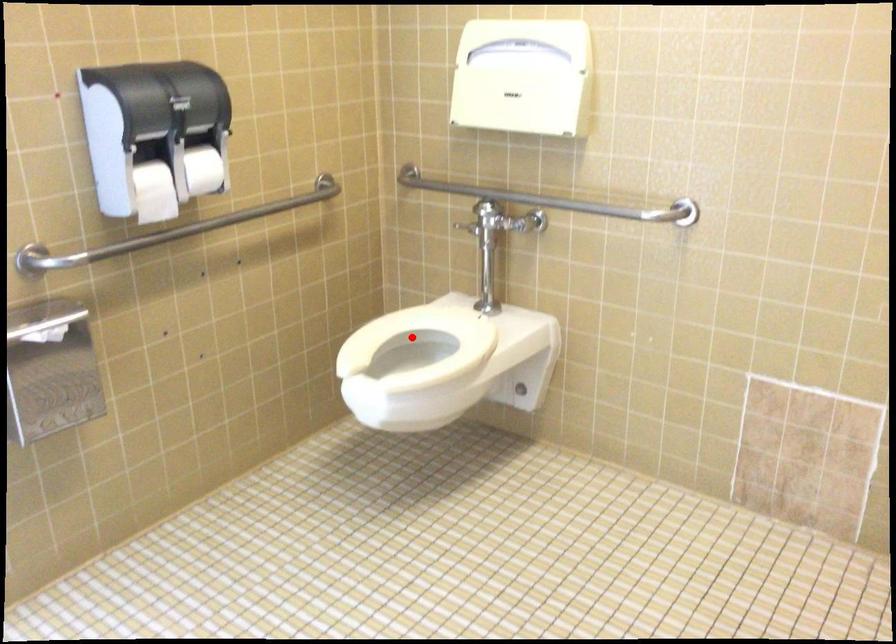
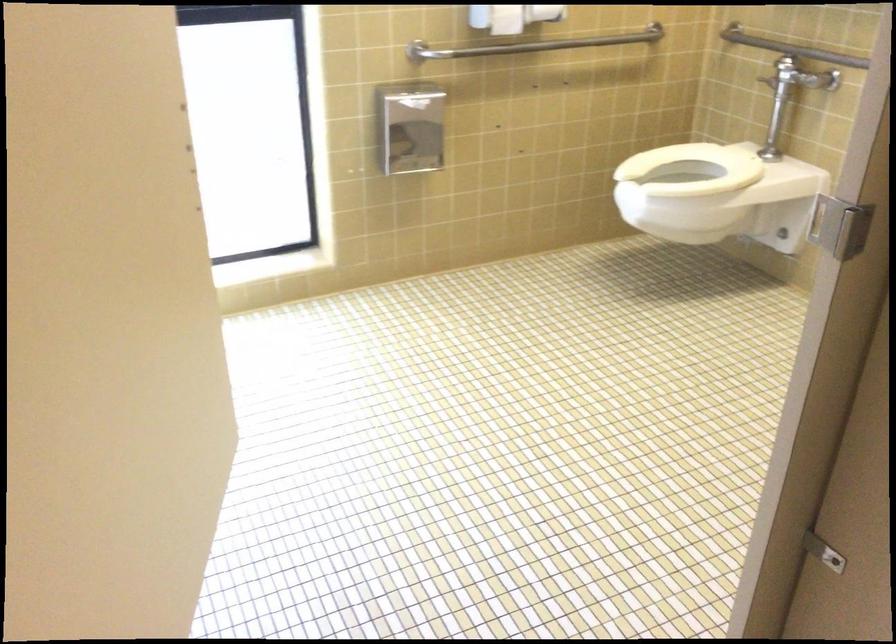
Where in the second image is the point corresponding to the highlighted location from the first image?

(692, 169)